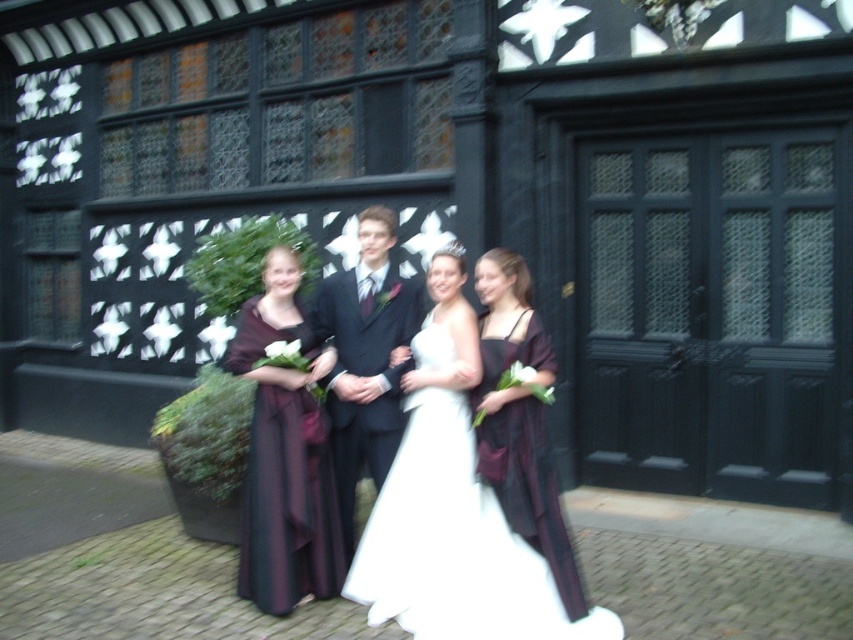
Who is positioned more to the left, black wooden door at center or dark suit at center?

Positioned to the left is dark suit at center.

Does black wooden door at center have a larger size compared to dark suit at center?

Indeed, black wooden door at center has a larger size compared to dark suit at center.

Is point (735, 332) positioned after point (360, 461)?

That is True.

Locate an element on the screen. This screenshot has height=640, width=853. black wooden door at center is located at coordinates (715, 312).

Who is more distant from viewer, (325, 593) or (341, 296)?

Positioned behind is point (341, 296).

Is dark purple satin dress at center wider than dark suit at center?

Yes.

Is point (294, 552) closer to camera compared to point (363, 433)?

Yes, it is in front of point (363, 433).

Locate an element on the screen. This screenshot has height=640, width=853. dark purple satin dress at center is located at coordinates (x=288, y=504).

Does white satin dress at center appear on the right side of dark purple satin dress at center?

Indeed, white satin dress at center is positioned on the right side of dark purple satin dress at center.

Who is shorter, white satin dress at center or dark purple satin dress at center?

white satin dress at center is shorter.

Which is behind, point (544, 579) or point (299, 582)?

Point (299, 582)

Image resolution: width=853 pixels, height=640 pixels. I want to click on white satin dress at center, so click(454, 545).